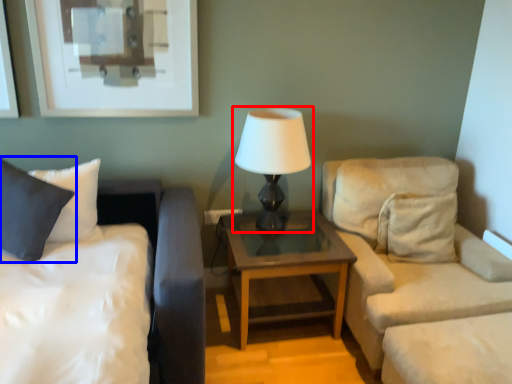
Question: Which point is closer to the camera, lamp (highlighted by a red box) or pillow (highlighted by a blue box)?

Choices:
 (A) lamp
 (B) pillow

Answer: (B)